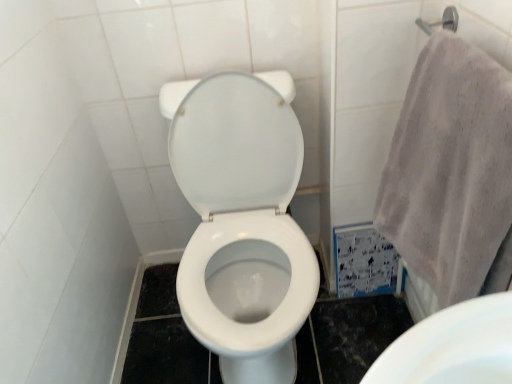
Question: Considering the relative positions of gray cotton towel at right and white glossy toilet at center in the image provided, is gray cotton towel at right behind white glossy toilet at center?

Choices:
 (A) no
 (B) yes

Answer: (A)

Question: Is gray cotton towel at right outside of white glossy toilet at center?

Choices:
 (A) yes
 (B) no

Answer: (A)

Question: Is gray cotton towel at right thinner than white glossy toilet at center?

Choices:
 (A) no
 (B) yes

Answer: (B)

Question: From the image's perspective, is gray cotton towel at right above white glossy toilet at center?

Choices:
 (A) yes
 (B) no

Answer: (A)

Question: Is gray cotton towel at right taller than white glossy toilet at center?

Choices:
 (A) yes
 (B) no

Answer: (B)

Question: Can you confirm if gray cotton towel at right is positioned to the left of white glossy toilet at center?

Choices:
 (A) yes
 (B) no

Answer: (B)

Question: Is white glossy toilet at center with gray cotton towel at right?

Choices:
 (A) no
 (B) yes

Answer: (A)

Question: Is the position of white glossy toilet at center more distant than that of gray cotton towel at right?

Choices:
 (A) no
 (B) yes

Answer: (B)

Question: From a real-world perspective, is white glossy toilet at center on gray cotton towel at right?

Choices:
 (A) no
 (B) yes

Answer: (A)

Question: Is white glossy toilet at center oriented away from gray cotton towel at right?

Choices:
 (A) yes
 (B) no

Answer: (B)

Question: From the image's perspective, is white glossy toilet at center located beneath gray cotton towel at right?

Choices:
 (A) yes
 (B) no

Answer: (A)

Question: Is white glossy toilet at center to the left of gray cotton towel at right from the viewer's perspective?

Choices:
 (A) yes
 (B) no

Answer: (A)

Question: In the image, is white glossy toilet at center positioned in front of or behind gray cotton towel at right?

Choices:
 (A) front
 (B) behind

Answer: (B)